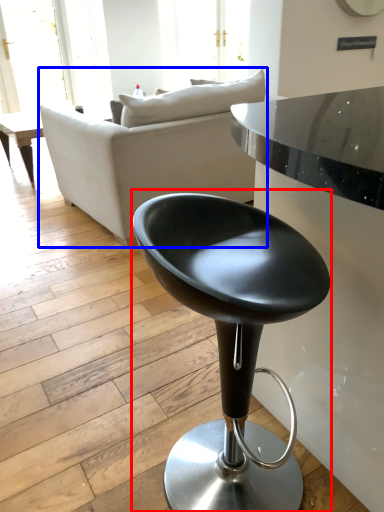
Question: Which object is further to the camera taking this photo, chair (highlighted by a red box) or studio couch (highlighted by a blue box)?

Choices:
 (A) chair
 (B) studio couch

Answer: (B)